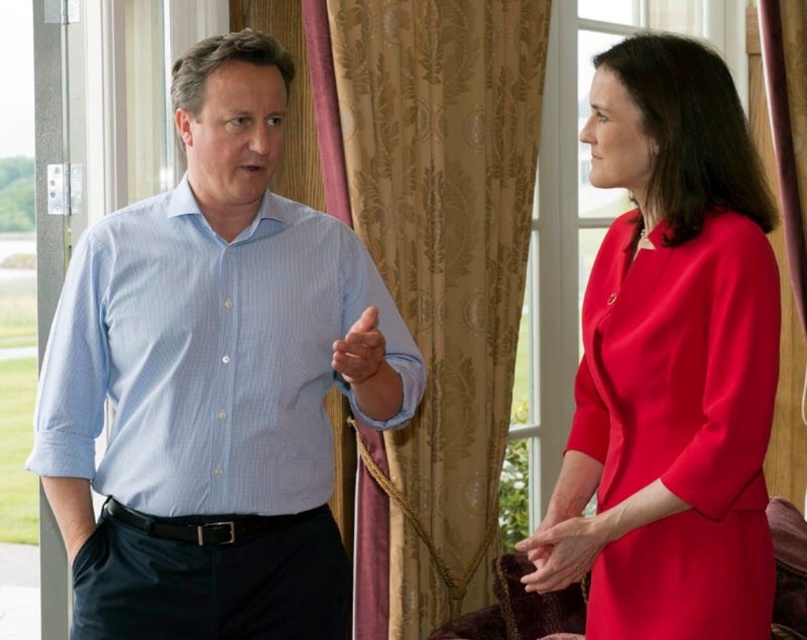
You are a photographer setting up for a group photo. You need to ensure that all subjects are visible in the frame. Given that the light blue striped shirt at left and the smooth red dress at center are the main focuses, which one might need to be moved closer to the camera to ensure visibility?

The light blue striped shirt at left is larger in size than the smooth red dress at center, so it might need to be moved closer to the camera to ensure visibility.

You are an interior designer assessing the spatial arrangement of the room. The light blue striped shirt at left and the matte red dress at right are part of the scene. Which object takes up more space in the image?

The light blue striped shirt at left takes up more space in the image as it is bigger than the matte red dress at right.

You are a photographer setting up a shoot in the scene described. You need to position a backdrop that is 1.2 meters wide. The backdrop must be placed where there is enough space between the light blue striped shirt at left and the gold textured curtain at center. Is there sufficient space for the backdrop?

The light blue striped shirt at left is wider than the gold textured curtain at center. Therefore, the space between them may be sufficient to accommodate the 1.2 meter wide backdrop, but exact measurements are needed for confirmation.